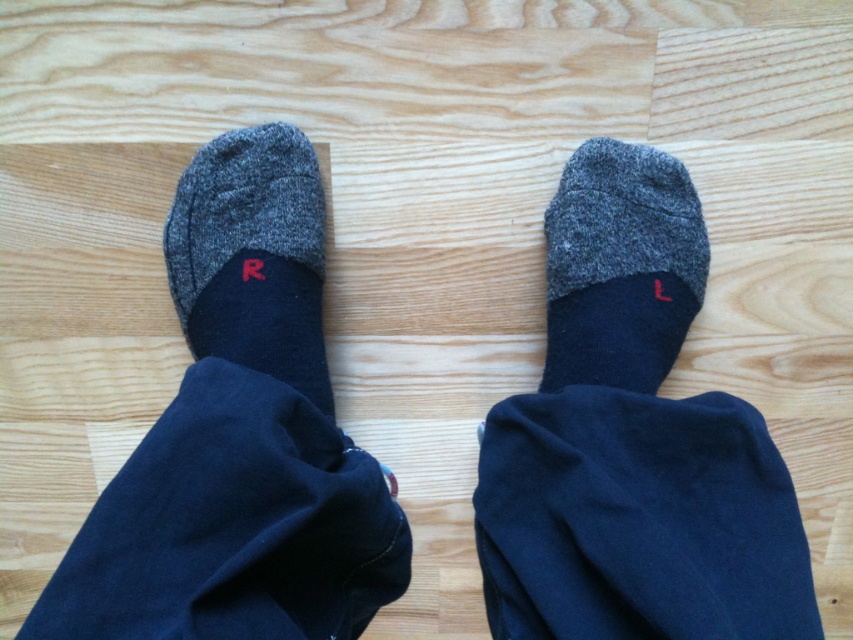
You are trying to locate the gray woolen sock at center in the image. According to the coordinates provided, where exactly is it positioned?

The gray woolen sock at center is positioned at coordinates point [619,266].

Based on the photo, you are a fashion designer examining a pair of socks. You notice the gray woolen sock at center and the dark gray wool sock at left. Which sock is positioned higher in the image?

The gray woolen sock at center is positioned higher than the dark gray wool sock at left.